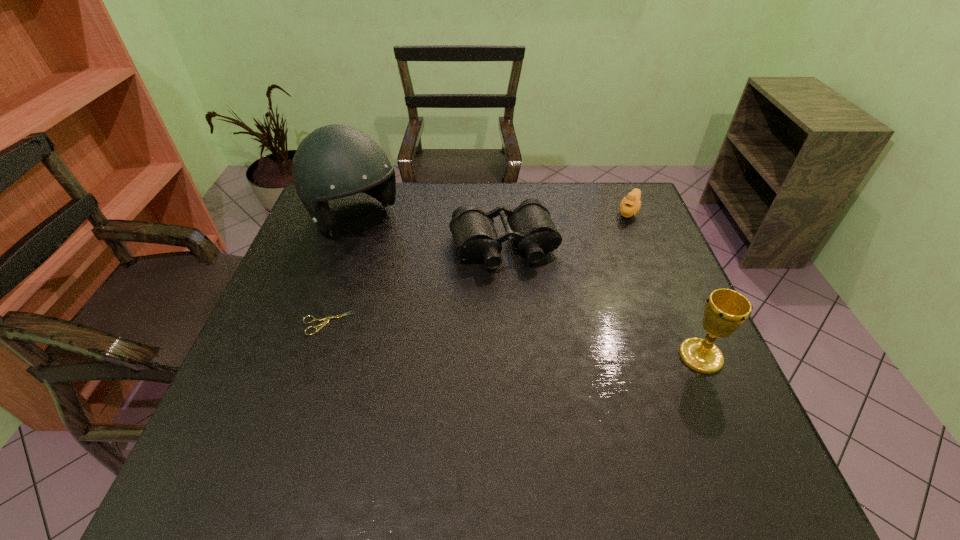
Locate an element on the screen. blank space located 0.080m through the eyepieces of the binoculars is located at coordinates (524, 296).

Identify the location of free region located through the eyepieces of the binoculars. (539, 336).

Find the location of a particular element. The width and height of the screenshot is (960, 540). blank space located at the face opening of the tallest object is located at coordinates (432, 289).

I want to click on blank space located at the face opening of the tallest object, so click(388, 249).

Image resolution: width=960 pixels, height=540 pixels. Identify the location of free spot located at the face opening of the tallest object. (425, 283).

Locate an element on the screen. vacant area located 0.080m on the face of the duckling is located at coordinates (619, 235).

Identify the location of free region located 0.280m on the face of the duckling. (597, 276).

Where is `vacant space positioned 0.300m on the face of the duckling`? vacant space positioned 0.300m on the face of the duckling is located at coordinates (595, 280).

Where is `binoculars that is at the far edge`? This screenshot has width=960, height=540. binoculars that is at the far edge is located at coordinates (530, 225).

Find the location of `football helmet present at the far edge`. football helmet present at the far edge is located at coordinates (334, 161).